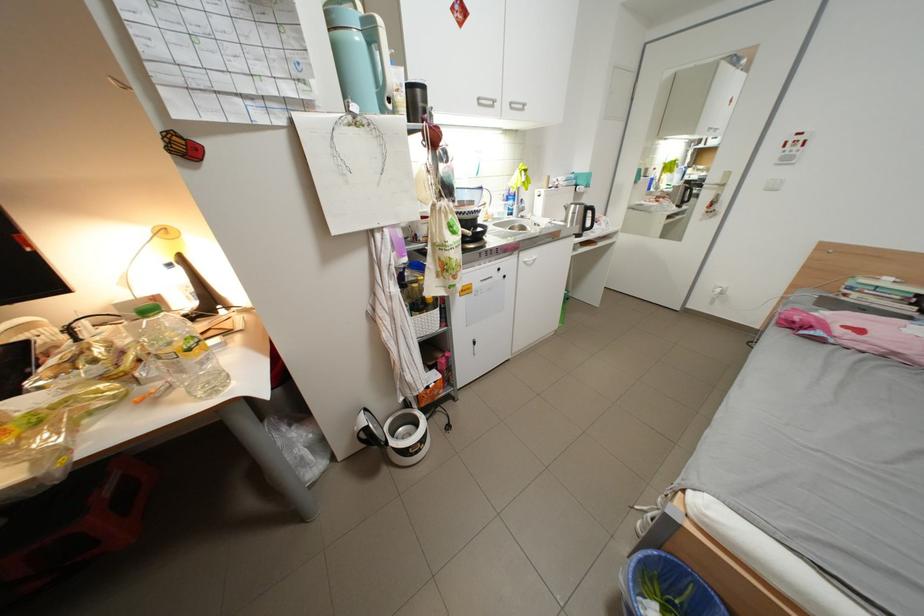
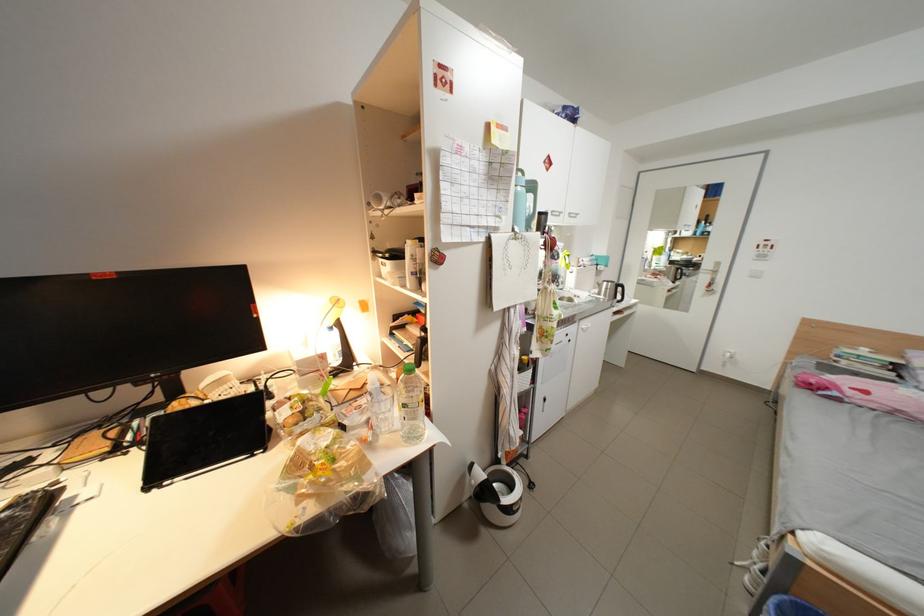
In the second image, find the point that corresponds to point (518, 264) in the first image.

(582, 331)